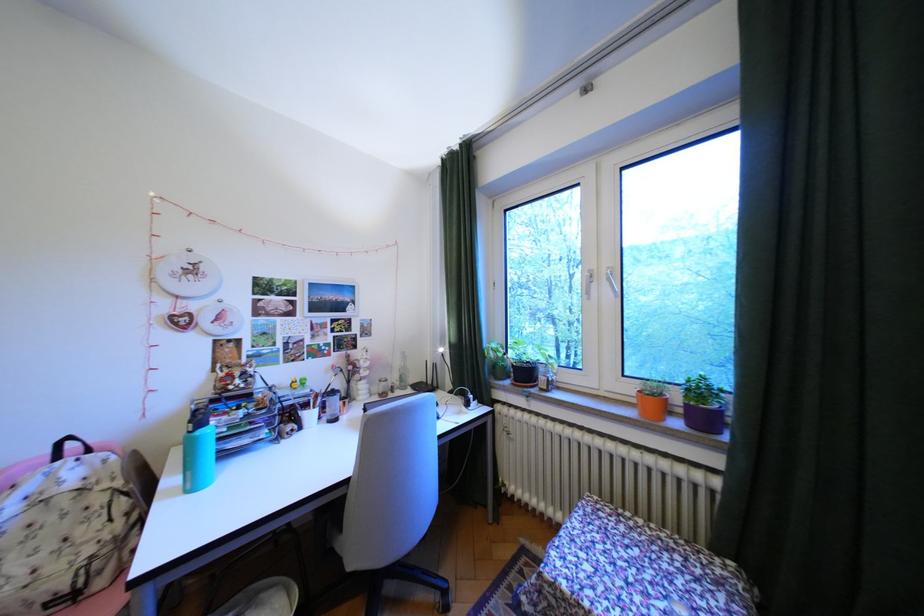
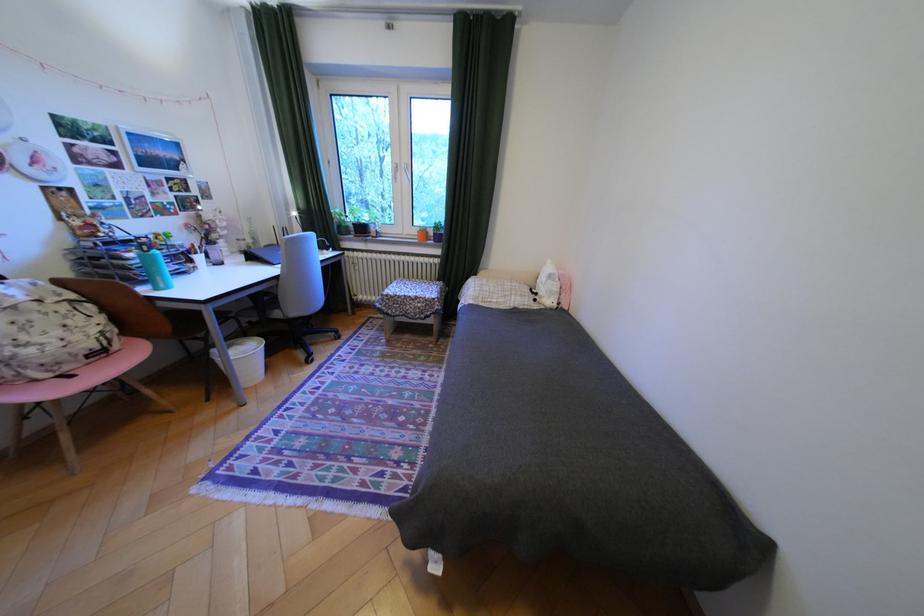
Find the pixel in the second image that matches the point at 641,390 in the first image.

(427, 232)